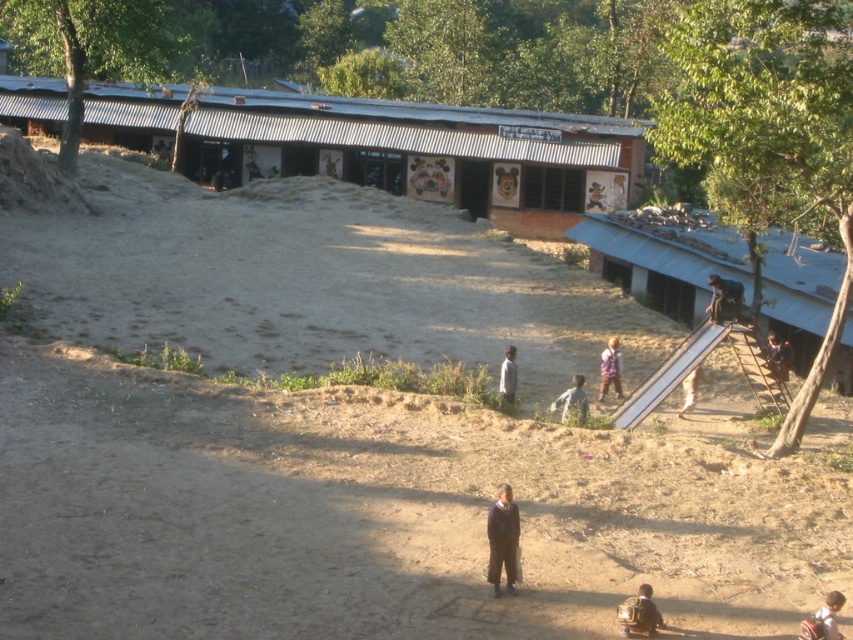
Consider the image. You are standing at the center of the schoolyard. Which direction should you walk to reach the blue corrugated metal hut at right?

You should walk to the right to reach the blue corrugated metal hut at right since it is located at the right side of the schoolyard.